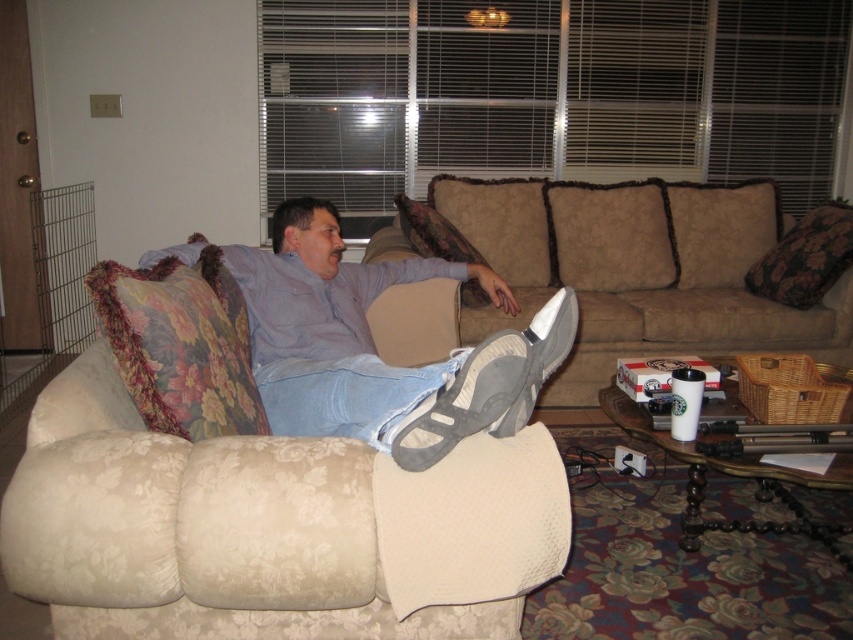
Can you confirm if gray fabric shoe at center is bigger than floral fabric pillow at right?

Yes, gray fabric shoe at center is bigger than floral fabric pillow at right.

What do you see at coordinates (374, 348) in the screenshot? This screenshot has height=640, width=853. I see `gray fabric shoe at center` at bounding box center [374, 348].

Is point (192, 256) behind point (787, 262)?

No.

Find the location of a particular element. Image resolution: width=853 pixels, height=640 pixels. gray fabric shoe at center is located at coordinates (374, 348).

Can you confirm if gray fabric shoe at center is wider than floral fabric pillow at center?

Correct, the width of gray fabric shoe at center exceeds that of floral fabric pillow at center.

From the picture: Who is positioned more to the right, gray fabric shoe at center or floral fabric pillow at center?

floral fabric pillow at center

You are a GUI agent. You are given a task and a screenshot of the screen. Output one action in this format:
    pyautogui.click(x=<x>, y=<y>)
    Task: Click on the gray fabric shoe at center
    
    Given the screenshot: What is the action you would take?
    pyautogui.click(x=374, y=348)

Is beige fabric couch at center above gray fabric shoe at center?

Yes.

What do you see at coordinates (637, 269) in the screenshot?
I see `beige fabric couch at center` at bounding box center [637, 269].

Image resolution: width=853 pixels, height=640 pixels. Find the location of `beige fabric couch at center`. beige fabric couch at center is located at coordinates (637, 269).

At what (x,y) coordinates should I click in order to perform the action: click on beige fabric couch at center. Please return your answer as a coordinate pair (x, y). The width and height of the screenshot is (853, 640). Looking at the image, I should click on (637, 269).